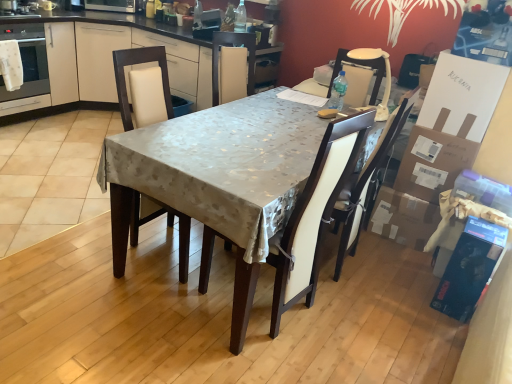
Question: Does cardboard box at right, which is counted as the first cardboard box, starting from the top, have a lesser width compared to beige fabric chair at upper right, the 3th chair positioned from the left?

Choices:
 (A) yes
 (B) no

Answer: (B)

Question: From a real-world perspective, is cardboard box at right, which is counted as the first cardboard box, starting from the top, positioned over beige fabric chair at upper right, arranged as the 1th chair when viewed from the right, based on gravity?

Choices:
 (A) no
 (B) yes

Answer: (A)

Question: Is cardboard box at right, which appears as the second cardboard box when ordered from the bottom, not inside beige fabric chair at upper right, the 3th chair positioned from the left?

Choices:
 (A) yes
 (B) no

Answer: (A)

Question: Can you confirm if cardboard box at right, which appears as the second cardboard box when ordered from the bottom, is bigger than beige fabric chair at upper right, arranged as the 1th chair when viewed from the right?

Choices:
 (A) no
 (B) yes

Answer: (B)

Question: Can you confirm if cardboard box at right, which appears as the second cardboard box when ordered from the bottom, is taller than beige fabric chair at upper right, arranged as the 1th chair when viewed from the right?

Choices:
 (A) yes
 (B) no

Answer: (A)

Question: Considering the positions of matte white chair at center, which appears as the first chair when viewed from the left, and white leather chair at center, the 2th chair in the right-to-left sequence, in the image, is matte white chair at center, which appears as the first chair when viewed from the left, wider or thinner than white leather chair at center, the 2th chair in the right-to-left sequence,?

Choices:
 (A) wide
 (B) thin

Answer: (A)

Question: Based on their positions, is matte white chair at center, placed as the third chair when sorted from right to left, located to the left or right of white leather chair at center, placed as the second chair when sorted from left to right?

Choices:
 (A) left
 (B) right

Answer: (A)

Question: Based on their sizes in the image, would you say matte white chair at center, which appears as the first chair when viewed from the left, is bigger or smaller than white leather chair at center, the 2th chair in the right-to-left sequence?

Choices:
 (A) small
 (B) big

Answer: (B)

Question: Considering the positions of point (134, 208) and point (309, 226), is point (134, 208) closer or farther from the camera than point (309, 226)?

Choices:
 (A) farther
 (B) closer

Answer: (A)

Question: Is matte white oven at left inside or outside of beige fabric chair at upper right, arranged as the 1th chair when viewed from the right?

Choices:
 (A) inside
 (B) outside

Answer: (B)

Question: From a real-world perspective, is matte white oven at left physically located above or below beige fabric chair at upper right, the 3th chair positioned from the left?

Choices:
 (A) below
 (B) above

Answer: (A)

Question: Considering the positions of matte white oven at left and beige fabric chair at upper right, arranged as the 1th chair when viewed from the right, in the image, is matte white oven at left wider or thinner than beige fabric chair at upper right, arranged as the 1th chair when viewed from the right,?

Choices:
 (A) wide
 (B) thin

Answer: (A)

Question: Is matte white oven at left bigger or smaller than beige fabric chair at upper right, arranged as the 1th chair when viewed from the right?

Choices:
 (A) small
 (B) big

Answer: (B)

Question: In terms of height, does satin silver microwave at upper center look taller or shorter compared to matte white chair at center, placed as the third chair when sorted from right to left?

Choices:
 (A) tall
 (B) short

Answer: (B)

Question: From a real-world perspective, relative to matte white chair at center, placed as the third chair when sorted from right to left, is satin silver microwave at upper center vertically above or below?

Choices:
 (A) below
 (B) above

Answer: (B)